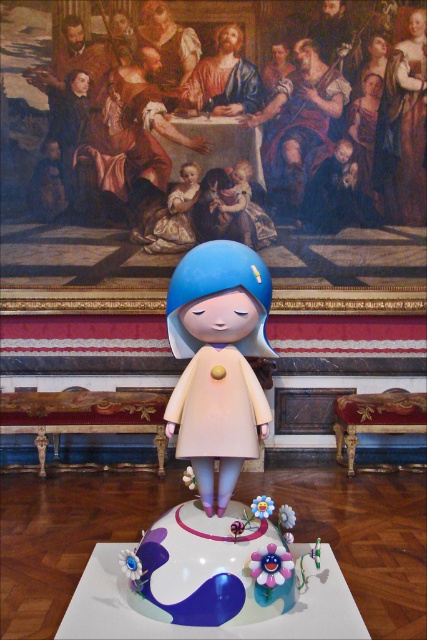
Question: Which point is farther to the camera?

Choices:
 (A) matte blue doll at center
 (B) matte blue cake at center

Answer: (A)

Question: Is the position of matte blue doll at center less distant than that of matte blue cake at center?

Choices:
 (A) no
 (B) yes

Answer: (A)

Question: Does matte blue doll at center have a larger size compared to matte blue cake at center?

Choices:
 (A) yes
 (B) no

Answer: (B)

Question: Observing the image, what is the correct spatial positioning of matte blue doll at center in reference to matte blue cake at center?

Choices:
 (A) below
 (B) above

Answer: (B)

Question: Which object is closer to the camera taking this photo?

Choices:
 (A) matte blue cake at center
 (B) matte blue doll at center

Answer: (A)